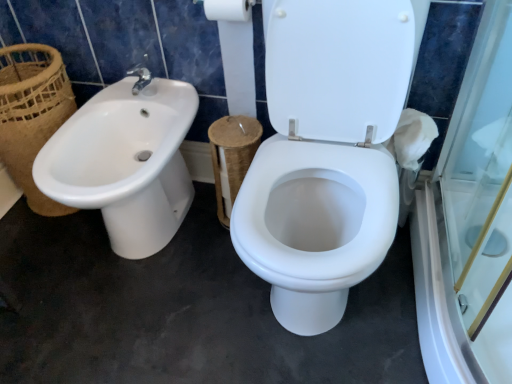
Question: Looking at the image, does white cardboard toilet paper at upper center seem bigger or smaller compared to white glossy sink at left?

Choices:
 (A) small
 (B) big

Answer: (A)

Question: From a real-world perspective, is white cardboard toilet paper at upper center positioned above or below white glossy sink at left?

Choices:
 (A) below
 (B) above

Answer: (B)

Question: Based on their relative distances, which object is farther from the brown woven basket at left?

Choices:
 (A) white glossy sink at left
 (B) white cardboard toilet paper at upper center

Answer: (B)

Question: Which of these objects is positioned farthest from the white cardboard toilet paper at upper center?

Choices:
 (A) brown woven basket at left
 (B) white glossy sink at left

Answer: (A)